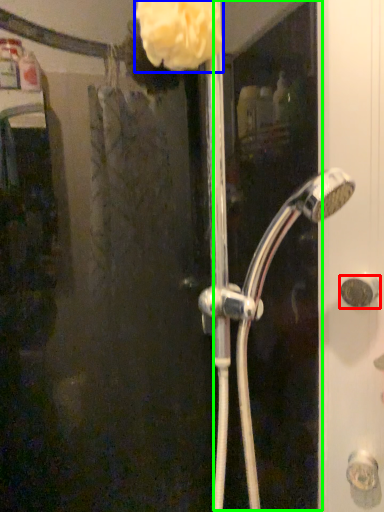
Question: Based on their relative distances, which object is nearer to door handle (highlighted by a red box)? Choose from flower (highlighted by a blue box) and screen door (highlighted by a green box).

Choices:
 (A) flower
 (B) screen door

Answer: (B)